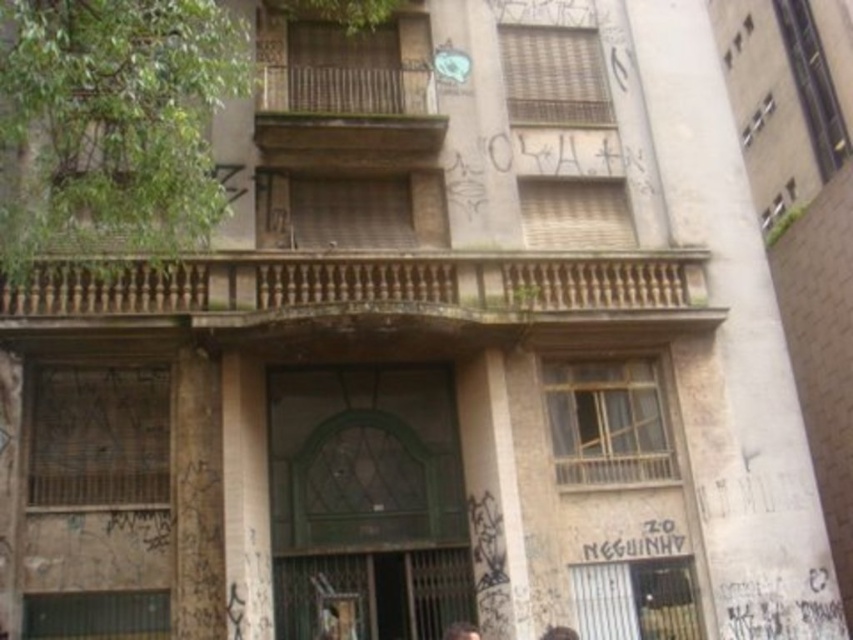
You are a painter hired to paint the smooth concrete pillar at right and the dark brown hair at lower center. Which object requires more paint due to its size?

The smooth concrete pillar at right requires more paint because it is larger in size than the dark brown hair at lower center.